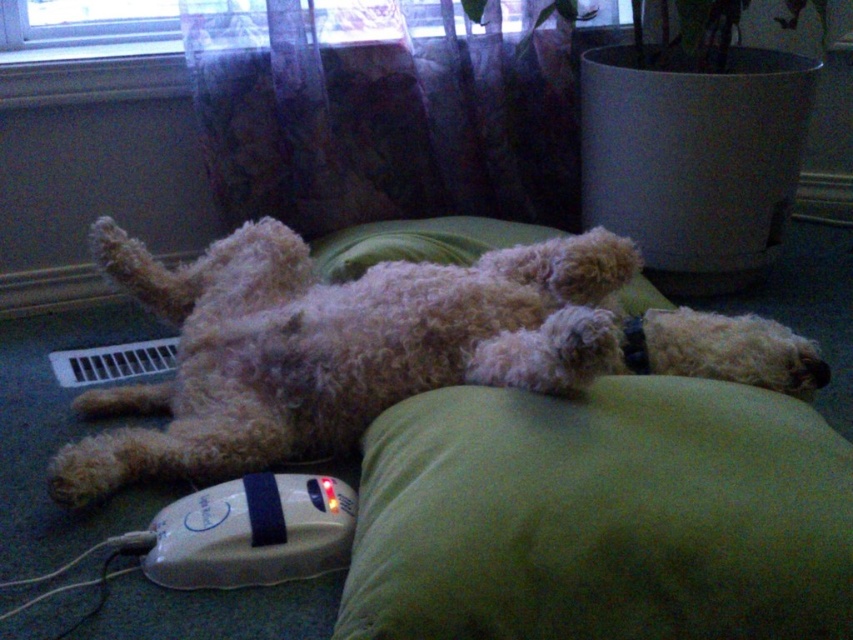
Question: Among these objects, which one is farthest from the camera?

Choices:
 (A) white plastic remote at lower left
 (B) fuzzy beige dog at center

Answer: (A)

Question: Can you confirm if fuzzy beige dog at center is positioned to the left of white plastic remote at lower left?

Choices:
 (A) no
 (B) yes

Answer: (A)

Question: Among these points, which one is nearest to the camera?

Choices:
 (A) pyautogui.click(x=264, y=332)
 (B) pyautogui.click(x=344, y=506)

Answer: (B)

Question: Is fuzzy beige dog at center to the left of white plastic remote at lower left from the viewer's perspective?

Choices:
 (A) yes
 (B) no

Answer: (B)

Question: In this image, where is fuzzy beige dog at center located relative to white plastic remote at lower left?

Choices:
 (A) left
 (B) right

Answer: (B)

Question: Which object is farther from the camera taking this photo?

Choices:
 (A) fuzzy beige dog at center
 (B) white plastic remote at lower left

Answer: (B)